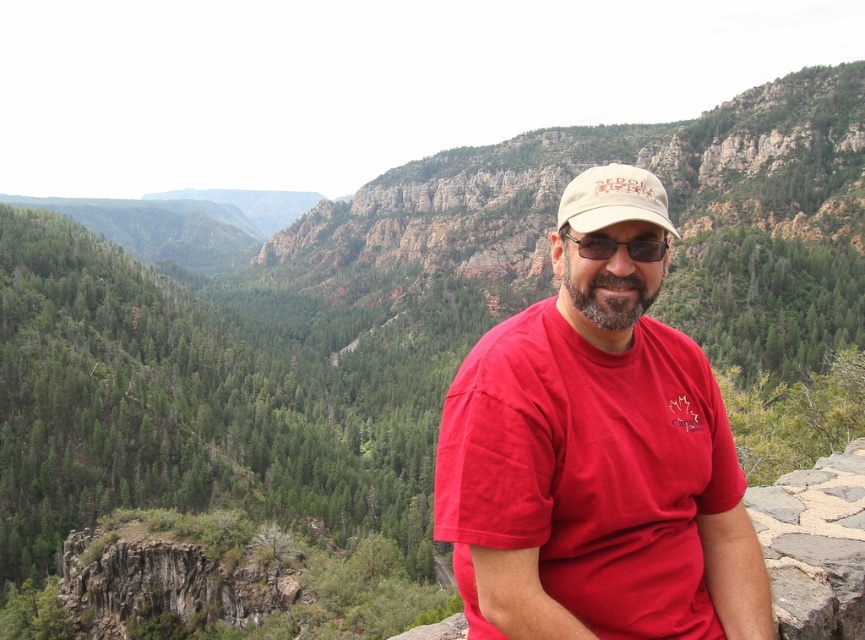
Which is above, matte red t-shirt at center or matte brown goggles at center?

matte brown goggles at center is higher up.

Where is `matte red t-shirt at center`? The image size is (865, 640). matte red t-shirt at center is located at coordinates (596, 452).

This screenshot has width=865, height=640. What are the coordinates of `matte red t-shirt at center` in the screenshot? It's located at (596, 452).

Who is more forward, (558, 225) or (578, 246)?

Point (578, 246) is more forward.

Between beige fabric cap at center and matte brown goggles at center, which one is positioned higher?

Positioned higher is beige fabric cap at center.

Is point (665, 230) positioned behind point (584, 246)?

No, (665, 230) is in front of (584, 246).

Where is `beige fabric cap at center`? The height and width of the screenshot is (640, 865). beige fabric cap at center is located at coordinates (613, 198).

Can you confirm if matte red t-shirt at center is smaller than beige fabric cap at center?

Yes, matte red t-shirt at center is smaller than beige fabric cap at center.

Between matte red t-shirt at center and beige fabric cap at center, which one appears on the right side from the viewer's perspective?

Positioned to the right is beige fabric cap at center.

Measure the distance between matte red t-shirt at center and camera.

They are 18.25 meters apart.

Identify the location of matte red t-shirt at center. The height and width of the screenshot is (640, 865). (596, 452).